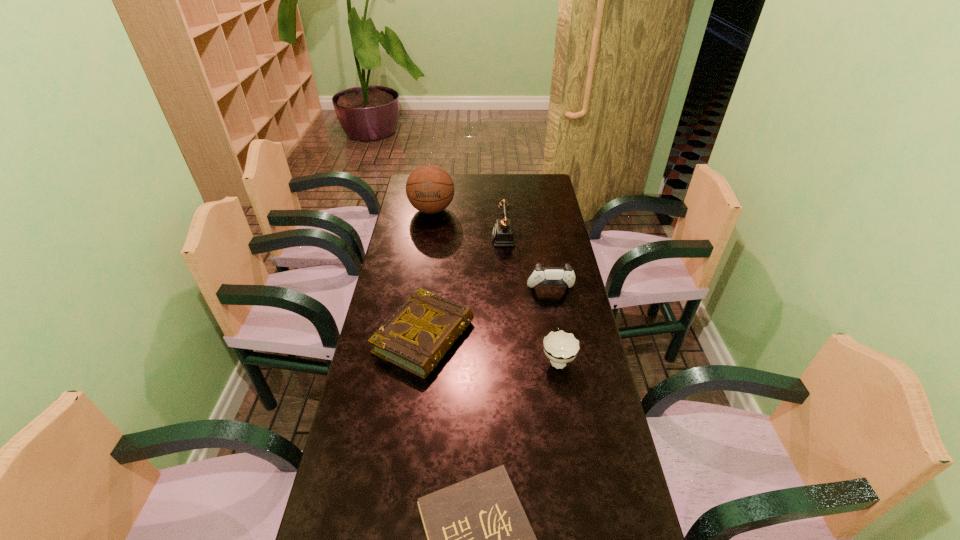
What are the coordinates of `control that is at the right edge` in the screenshot? It's located at (541, 275).

The height and width of the screenshot is (540, 960). Identify the location of cup present at the right edge. (560, 347).

In order to click on object present at the far left corner in this screenshot , I will do `click(430, 189)`.

Where is `blank space at the far edge of the desktop`? This screenshot has height=540, width=960. blank space at the far edge of the desktop is located at coordinates (461, 179).

The width and height of the screenshot is (960, 540). In the image, there is a desktop. Identify the location of vacant area at the left edge. coord(392,294).

In the image, there is a desktop. Identify the location of free space at the right edge. This screenshot has width=960, height=540. (556, 225).

The width and height of the screenshot is (960, 540). Identify the location of vacant area at the far right corner of the desktop. (541, 180).

Locate an element on the screen. This screenshot has height=540, width=960. free spot between the fourth shortest object and the second farthest object is located at coordinates (529, 265).

I want to click on vacant space that's between the fifth nearest object and the cup, so (532, 299).

Locate an element on the screen. The image size is (960, 540). free point between the second farthest object and the basketball is located at coordinates (469, 225).